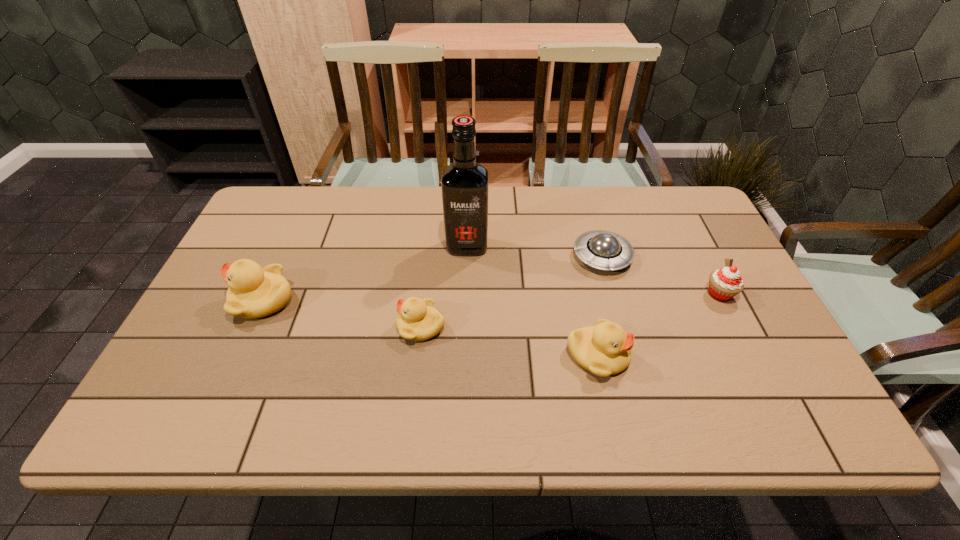
The width and height of the screenshot is (960, 540). I want to click on the leftmost object, so click(x=253, y=292).

At what (x,y) coordinates should I click in order to perform the action: click on the second duckling from right to left. Please return your answer as a coordinate pair (x, y). The image size is (960, 540). Looking at the image, I should click on (418, 320).

This screenshot has height=540, width=960. Identify the location of the fifth tallest object. (418, 320).

Find the location of a particular element. This screenshot has width=960, height=540. the rightmost duckling is located at coordinates pyautogui.click(x=605, y=349).

Image resolution: width=960 pixels, height=540 pixels. In order to click on the rightmost object in this screenshot , I will do `click(725, 283)`.

At what (x,y) coordinates should I click in order to perform the action: click on the tallest object. Please return your answer as a coordinate pair (x, y). Looking at the image, I should click on (465, 184).

Locate an element on the screen. saucer is located at coordinates (605, 250).

At what (x,y) coordinates should I click in order to perform the action: click on vacant space located 0.050m at the face of the leftmost object. Please return your answer as a coordinate pair (x, y). The height and width of the screenshot is (540, 960). Looking at the image, I should click on 212,300.

At what (x,y) coordinates should I click in order to perform the action: click on vacant region located 0.050m at the face of the fifth tallest object. Please return your answer as a coordinate pair (x, y). This screenshot has width=960, height=540. Looking at the image, I should click on [x=376, y=326].

Find the location of a particular element. The image size is (960, 540). vacant space located 0.320m at the face of the fifth tallest object is located at coordinates (267, 326).